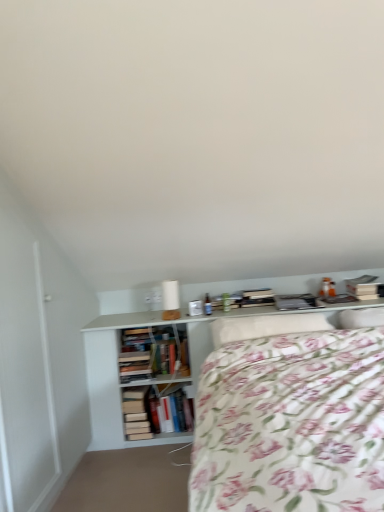
The image size is (384, 512). I want to click on white soft pillow at upper right, so click(x=361, y=318).

The height and width of the screenshot is (512, 384). What do you see at coordinates (136, 413) in the screenshot?
I see `hardcover books at center` at bounding box center [136, 413].

The image size is (384, 512). I want to click on white soft pillow at upper right, so click(x=361, y=318).

Between floral fabric bed at center and white matte shelf at center, which one is positioned behind?

white matte shelf at center is behind.

Who is shorter, floral fabric bed at center or white matte shelf at center?

Standing shorter between the two is floral fabric bed at center.

Would you say floral fabric bed at center is a long distance from white matte shelf at center?

Yes.

Is white matte shelf at center surrounded by floral fabric bed at center?

No, white matte shelf at center is not a part of floral fabric bed at center.

Where is `pillow on the right of floral fabric bed at center`? pillow on the right of floral fabric bed at center is located at coordinates (361, 318).

From the image's perspective, is white soft pillow at upper right beneath floral fabric bed at center?

No, from the image's perspective, white soft pillow at upper right is not beneath floral fabric bed at center.

Is the depth of white soft pillow at upper right greater than that of floral fabric bed at center?

Yes, white soft pillow at upper right is behind floral fabric bed at center.

Is white soft pillow at upper right to the left of floral fabric bed at center from the viewer's perspective?

Incorrect, white soft pillow at upper right is not on the left side of floral fabric bed at center.

From a real-world perspective, between floral fabric bed at center and hardcover books at center, who is vertically lower?

In real-world perspective, hardcover books at center is lower.

Considering the sizes of objects floral fabric bed at center and hardcover books at center in the image provided, who is shorter, floral fabric bed at center or hardcover books at center?

hardcover books at center.

Which object is positioned more to the left, floral fabric bed at center or hardcover books at center?

From the viewer's perspective, hardcover books at center appears more on the left side.

This screenshot has height=512, width=384. Identify the location of book on the left of floral fabric bed at center. (136, 413).

Is white soft pillow at upper right far away from hardcover books at center?

Absolutely, white soft pillow at upper right is distant from hardcover books at center.

How many degrees apart are the facing directions of white soft pillow at upper right and hardcover books at center?

white soft pillow at upper right and hardcover books at center are facing 0.000798 degrees away from each other.

Which is more to the right, white soft pillow at upper right or hardcover books at center?

Positioned to the right is white soft pillow at upper right.

Looking at this image, how distant is white soft pillow at upper right from hardcover books at center?

white soft pillow at upper right is 1.44 meters from hardcover books at center.

Between white matte shelf at center and white soft pillow at upper right, which one has larger size?

white matte shelf at center.

How far apart are white matte shelf at center and white soft pillow at upper right?

→ white matte shelf at center is 1.35 meters away from white soft pillow at upper right.

Can you tell me how much white matte shelf at center and white soft pillow at upper right differ in facing direction?

The angle between the facing direction of white matte shelf at center and the facing direction of white soft pillow at upper right is 0.000365 degrees.

Find the location of a particular element. The width and height of the screenshot is (384, 512). pillow in front of the white matte shelf at center is located at coordinates (361, 318).

From the image's perspective, is white matte shelf at center on top of hardcover books at center?

Yes, from the image's perspective, white matte shelf at center is over hardcover books at center.

Is white matte shelf at center spatially inside hardcover books at center, or outside of it?

white matte shelf at center cannot be found inside hardcover books at center.

Which object is further away from the camera, white matte shelf at center or hardcover books at center?

hardcover books at center.

Locate an element on the screen. book that is below the white matte shelf at center (from the image's perspective) is located at coordinates (136, 413).

Consider the image. Considering the sizes of white soft pillow at upper right and white matte shelf at center in the image, is white soft pillow at upper right taller or shorter than white matte shelf at center?

Clearly, white soft pillow at upper right is shorter compared to white matte shelf at center.

From the picture: Does white soft pillow at upper right appear on the left side of white matte shelf at center?

No.

Is point (355, 314) closer to camera compared to point (112, 374)?

Yes, it is.

The height and width of the screenshot is (512, 384). In the image, there is a white matte shelf at center. Find the location of `bed below it (from the image's perspective)`. bed below it (from the image's perspective) is located at coordinates (290, 419).

Find the location of a particular element. The width and height of the screenshot is (384, 512). bed below the white soft pillow at upper right (from a real-world perspective) is located at coordinates (290, 419).

Based on their spatial positions, is white soft pillow at upper right or floral fabric bed at center closer to hardcover books at center?

Based on the image, floral fabric bed at center appears to be nearer to hardcover books at center.

Based on their spatial positions, is hardcover books at center or white soft pillow at upper right closer to white matte shelf at center?

hardcover books at center.

From the image, which object appears to be nearer to white soft pillow at upper right, floral fabric bed at center or hardcover books at center?

floral fabric bed at center is closer to white soft pillow at upper right.

Consider the image. Considering their positions, is white matte shelf at center positioned further to hardcover books at center than white soft pillow at upper right?

white soft pillow at upper right.

Looking at the image, which one is located closer to white matte shelf at center, white soft pillow at upper right or floral fabric bed at center?

The object closer to white matte shelf at center is floral fabric bed at center.

When comparing their distances from white soft pillow at upper right, does hardcover books at center or white matte shelf at center seem further?

hardcover books at center is positioned further to the anchor white soft pillow at upper right.

Estimate the real-world distances between objects in this image. Which object is closer to white matte shelf at center, floral fabric bed at center or hardcover books at center?

hardcover books at center is positioned closer to the anchor white matte shelf at center.

Estimate the real-world distances between objects in this image. Which object is closer to hardcover books at center, floral fabric bed at center or white soft pillow at upper right?

floral fabric bed at center is positioned closer to the anchor hardcover books at center.

Locate an element on the screen. pillow positioned between floral fabric bed at center and white matte shelf at center from near to far is located at coordinates (361, 318).

Find the location of a particular element. pillow between floral fabric bed at center and hardcover books at center from front to back is located at coordinates (361, 318).

I want to click on shelf located between hardcover books at center and white soft pillow at upper right in the left-right direction, so click(113, 367).

I want to click on shelf positioned between floral fabric bed at center and hardcover books at center from near to far, so click(113, 367).